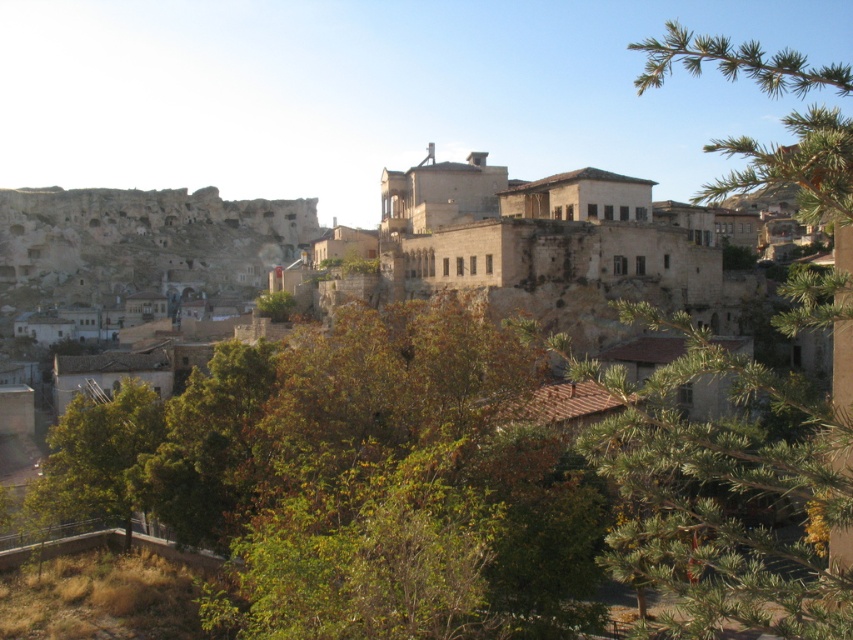
Is point (503, 189) positioned after point (840, 451)?

Yes, it is behind point (840, 451).

You are a GUI agent. You are given a task and a screenshot of the screen. Output one action in this format:
    pyautogui.click(x=<x>, y=<y>)
    Task: Click on the brown stone village at center
    This screenshot has width=853, height=640.
    Given the screenshot: What is the action you would take?
    pyautogui.click(x=412, y=244)

Identify the location of brown stone village at center. This screenshot has width=853, height=640. (412, 244).

Image resolution: width=853 pixels, height=640 pixels. In order to click on brown stone village at center in this screenshot , I will do `click(412, 244)`.

Does point (651, 328) lie in front of point (97, 509)?

No, it is not.

Does point (782, 609) lie behind point (120, 500)?

No.

At what (x,y) coordinates should I click in order to perform the action: click on green needle-like leaves at upper right. Please return your answer as a coordinate pair (x, y). The image size is (853, 640). Looking at the image, I should click on (724, 492).

Can you confirm if brown stone village at center is taller than green leafy tree at lower left?

Yes, brown stone village at center is taller than green leafy tree at lower left.

Consider the image. Can you confirm if brown stone village at center is positioned above green leafy tree at lower left?

Correct, brown stone village at center is located above green leafy tree at lower left.

Is point (569, 273) closer to camera compared to point (158, 428)?

That is False.

Locate an element on the screen. brown stone village at center is located at coordinates (412, 244).